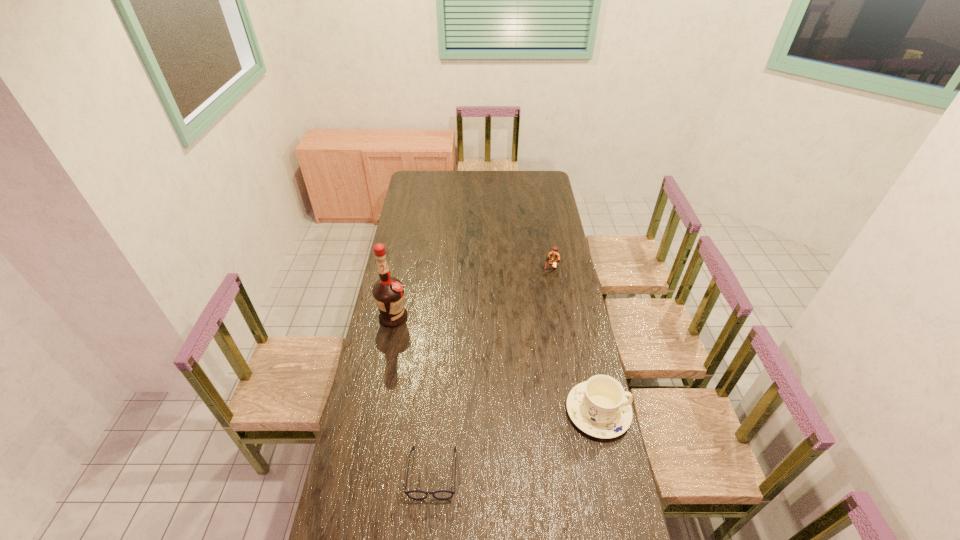
Find the location of a particular element. This screenshot has height=540, width=960. vacant space located 0.050m holding a crossbow in the hands of the farthest object is located at coordinates (545, 281).

At what (x,y) coordinates should I click in order to perform the action: click on free space located holding a crossbow in the hands of the farthest object. Please return your answer as a coordinate pair (x, y). The image size is (960, 540). Looking at the image, I should click on (540, 299).

Where is `vacant area located holding a crossbow in the hands of the farthest object`? vacant area located holding a crossbow in the hands of the farthest object is located at coordinates (535, 314).

The image size is (960, 540). Find the location of `object that is at the left edge`. object that is at the left edge is located at coordinates (388, 292).

Where is `chinaware present at the right edge`? chinaware present at the right edge is located at coordinates (599, 407).

What are the coordinates of `Lego that is positioned at the right edge` in the screenshot? It's located at (554, 258).

At what (x,y) coordinates should I click in order to perform the action: click on vacant area at the far edge of the desktop. Please return your answer as a coordinate pair (x, y). This screenshot has width=960, height=540. Looking at the image, I should click on click(x=486, y=172).

Find the location of a particular element. This screenshot has height=540, width=960. free space at the left edge of the desktop is located at coordinates (411, 259).

Locate an element on the screen. The image size is (960, 540). vacant space at the right edge of the desktop is located at coordinates (x=544, y=243).

Find the location of `free space at the far right corner of the desktop`. free space at the far right corner of the desktop is located at coordinates (537, 187).